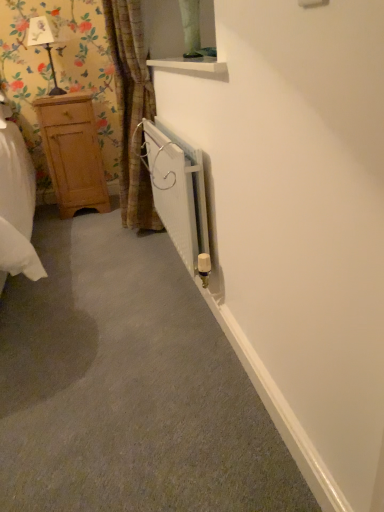
Question: Is matte black lamp at upper left next to brown textured curtain at left and touching it?

Choices:
 (A) no
 (B) yes

Answer: (A)

Question: Is matte black lamp at upper left wider than brown textured curtain at left?

Choices:
 (A) yes
 (B) no

Answer: (B)

Question: From a real-world perspective, is matte black lamp at upper left physically below brown textured curtain at left?

Choices:
 (A) yes
 (B) no

Answer: (B)

Question: Is matte black lamp at upper left at the left side of brown textured curtain at left?

Choices:
 (A) yes
 (B) no

Answer: (A)

Question: Can you confirm if matte black lamp at upper left is taller than brown textured curtain at left?

Choices:
 (A) yes
 (B) no

Answer: (B)

Question: Is matte black lamp at upper left looking in the opposite direction of brown textured curtain at left?

Choices:
 (A) no
 (B) yes

Answer: (A)

Question: Is light brown wooden dresser at left to the right of brown textured curtain at left from the viewer's perspective?

Choices:
 (A) no
 (B) yes

Answer: (A)

Question: From a real-world perspective, is light brown wooden dresser at left below brown textured curtain at left?

Choices:
 (A) no
 (B) yes

Answer: (B)

Question: Could brown textured curtain at left be considered to be inside light brown wooden dresser at left?

Choices:
 (A) no
 (B) yes

Answer: (A)

Question: Considering the relative sizes of light brown wooden dresser at left and brown textured curtain at left in the image provided, is light brown wooden dresser at left shorter than brown textured curtain at left?

Choices:
 (A) no
 (B) yes

Answer: (B)

Question: Considering the relative sizes of light brown wooden dresser at left and brown textured curtain at left in the image provided, is light brown wooden dresser at left bigger than brown textured curtain at left?

Choices:
 (A) yes
 (B) no

Answer: (B)

Question: Does light brown wooden dresser at left have a smaller size compared to brown textured curtain at left?

Choices:
 (A) no
 (B) yes

Answer: (B)

Question: Is brown textured curtain at left positioned behind white metallic radiator at center?

Choices:
 (A) yes
 (B) no

Answer: (A)